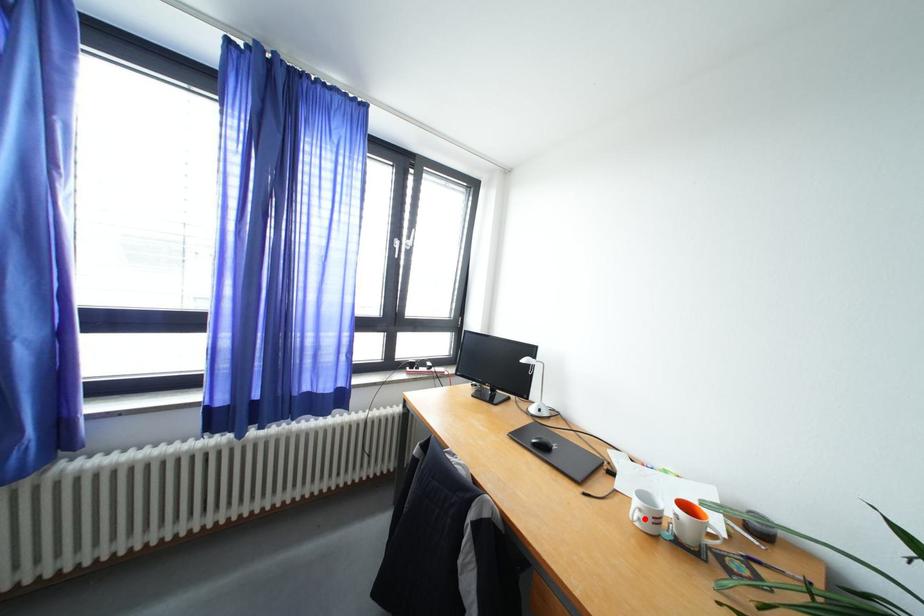
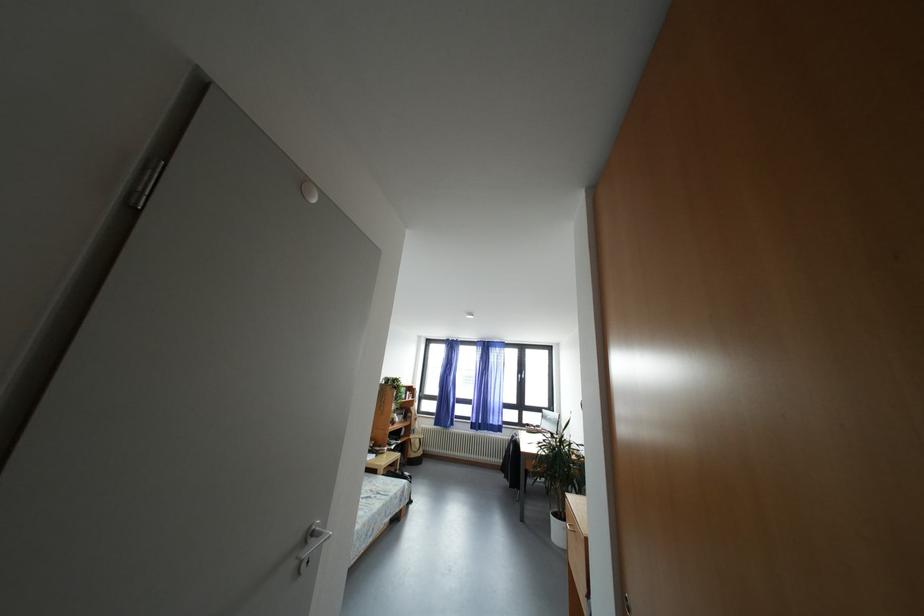
Question: I am providing you with two images of the same scene from different viewpoints. A red point is marked on the first image. Is the red point's position out of view in image 2?

Choices:
 (A) Yes
 (B) No

Answer: (A)